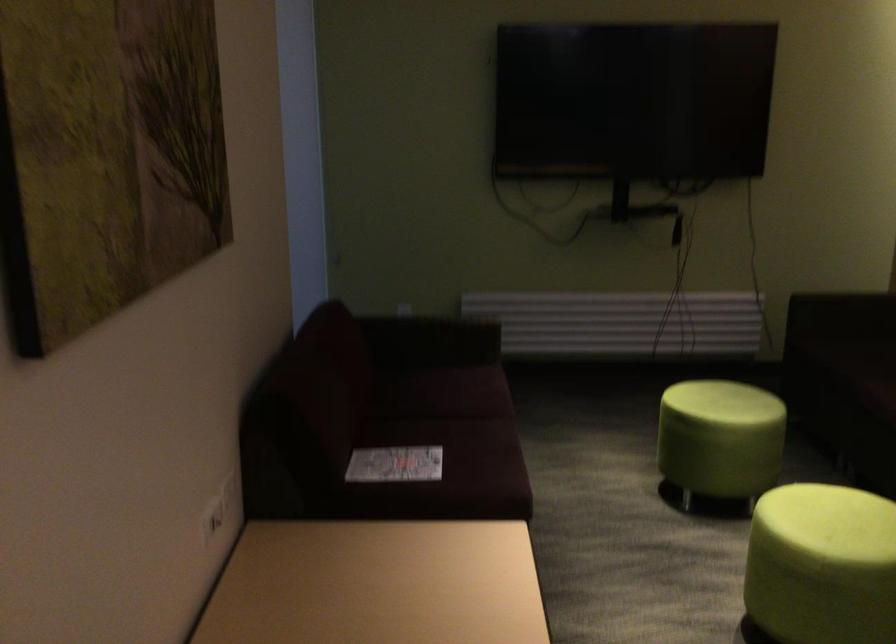
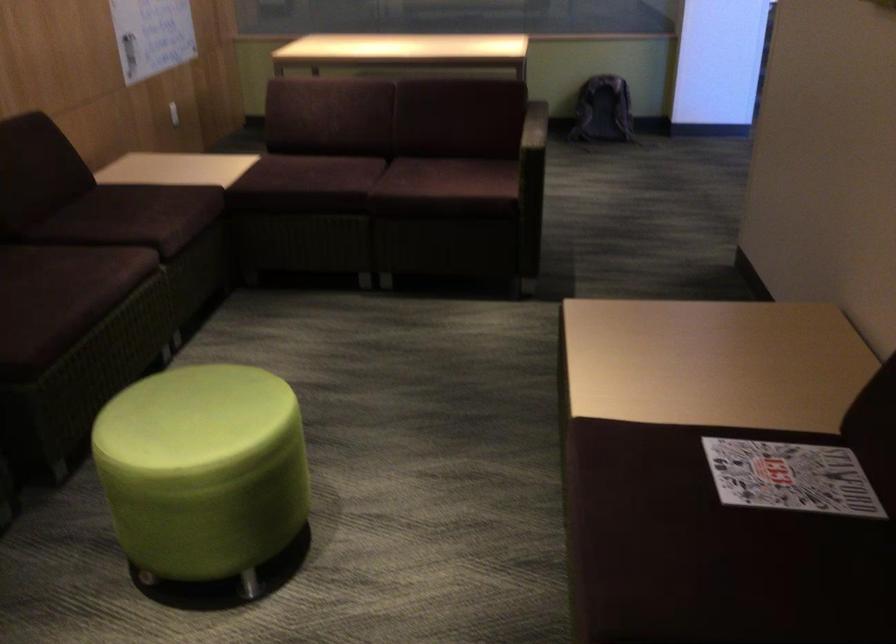
Find the pixel in the second image that matches [392,466] in the first image.

(790, 477)